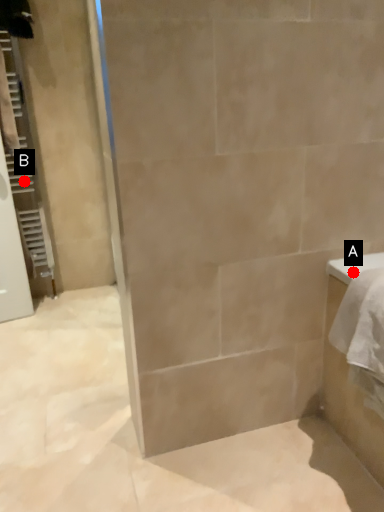
Question: Two points are circled on the image, labeled by A and B beside each circle. Which point is closer to the camera?

Choices:
 (A) A is closer
 (B) B is closer

Answer: (A)